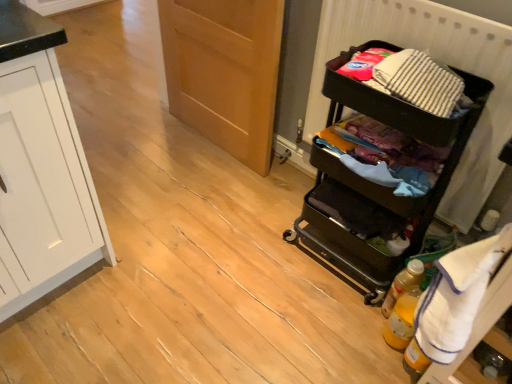
At what (x,y) coordinates should I click in order to perform the action: click on free space in front of translucent yellow bottle at lower right, marked as the second bottle in a front-to-back arrangement. Please return your answer as a coordinate pair (x, y). The image size is (512, 384). Looking at the image, I should click on (369, 351).